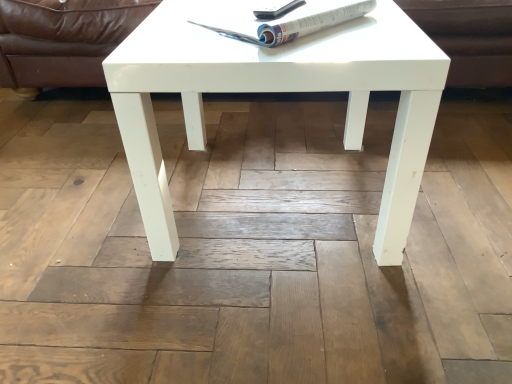
At what (x,y) coordinates should I click in order to perform the action: click on vacant space underneath white glossy coffee table at center (from a real-world perspective). Please return your answer as a coordinate pair (x, y). Image resolution: width=512 pixels, height=384 pixels. Looking at the image, I should click on (268, 194).